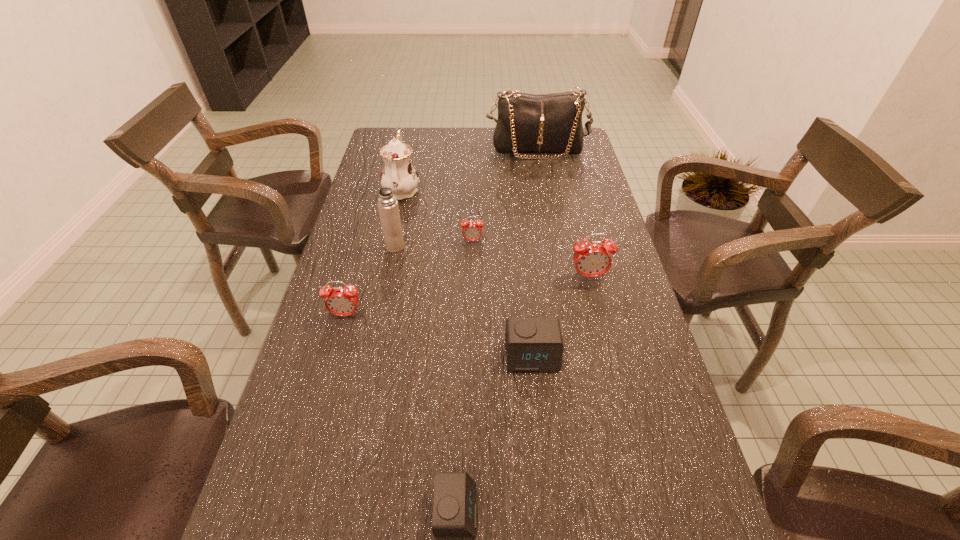
This screenshot has width=960, height=540. I want to click on vacant space located 0.160m on the front-facing side of the farther black alarm clock, so click(x=540, y=443).

I want to click on free location located on the front-facing side of the left black alarm clock, so click(x=669, y=510).

Find the location of a particular element. This screenshot has height=540, width=960. object located at the far edge is located at coordinates (544, 124).

Find the location of `chinaware that is at the left edge`. chinaware that is at the left edge is located at coordinates (398, 174).

This screenshot has height=540, width=960. Identify the location of thermos bottle positioned at the left edge. (387, 204).

This screenshot has height=540, width=960. In order to click on alarm clock present at the left edge in this screenshot , I will do `click(339, 301)`.

Locate an element on the screen. The width and height of the screenshot is (960, 540). handbag positioned at the right edge is located at coordinates (544, 124).

The height and width of the screenshot is (540, 960). Identify the location of alarm clock located in the right edge section of the desktop. (593, 259).

You are a GUI agent. You are given a task and a screenshot of the screen. Output one action in this format:
    pyautogui.click(x=<x>, y=<y>)
    Task: Click on the object positioned at the far right corner
    Image resolution: width=960 pixels, height=540 pixels.
    Given the screenshot: What is the action you would take?
    pyautogui.click(x=544, y=124)

At what (x,y) coordinates should I click in order to perform the action: click on vacant position at the far edge of the desktop. Please return your answer as a coordinate pair (x, y). Looking at the image, I should click on (492, 148).